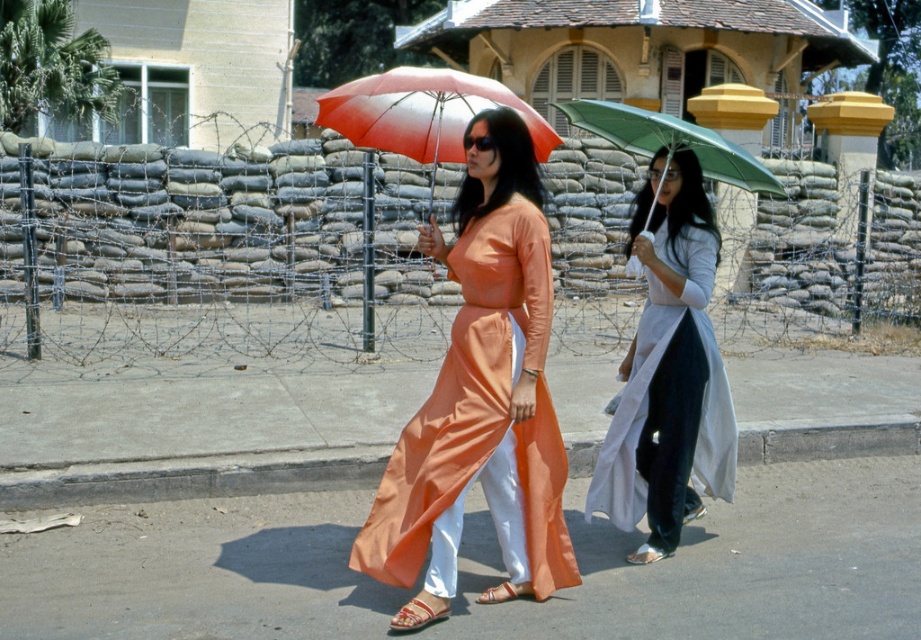
Does smooth asphalt at lower center appear under white silk ao dai at center?

Correct, smooth asphalt at lower center is located below white silk ao dai at center.

Between smooth asphalt at lower center and white silk ao dai at center, which one is positioned higher?

Positioned higher is white silk ao dai at center.

I want to click on smooth asphalt at lower center, so click(x=729, y=563).

Looking at this image, measure the distance between point (858, 595) and camera.

Point (858, 595) is 6.09 meters away from camera.

Which of these two, smooth asphalt at lower center or red matte umbrella at center, stands taller?

red matte umbrella at center

Which is in front, point (758, 480) or point (381, 132)?

Point (381, 132) is more forward.

Locate an element on the screen. smooth asphalt at lower center is located at coordinates (729, 563).

Who is taller, white silk ao dai at center or green matte umbrella at center?

white silk ao dai at center is taller.

Is white silk ao dai at center in front of green matte umbrella at center?

That is True.

Is point (640, 554) behind point (752, 163)?

Yes.

Identify the location of white silk ao dai at center. The width and height of the screenshot is (921, 640). (668, 372).